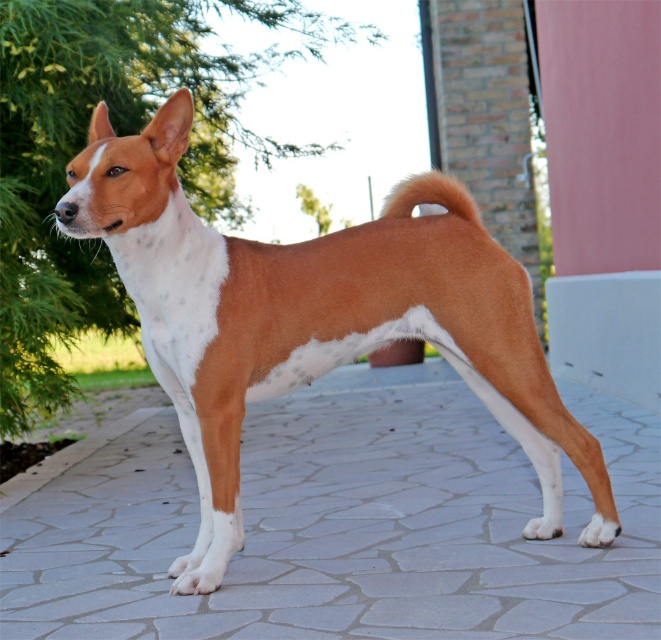
Question: Which object is closer to the camera taking this photo?

Choices:
 (A) brown furry tail at upper right
 (B) gray stone pavement at center

Answer: (A)

Question: Can you confirm if gray stone pavement at center is positioned below brown furry tail at upper right?

Choices:
 (A) no
 (B) yes

Answer: (B)

Question: Which point is farther to the camera?

Choices:
 (A) gray stone pavement at center
 (B) brown furry tail at upper right

Answer: (A)

Question: Which object is closer to the camera taking this photo?

Choices:
 (A) brown furry tail at upper right
 (B) brown/white fur dog at center
 (C) gray stone pavement at center

Answer: (B)

Question: Is the position of brown/white fur dog at center more distant than that of brown furry tail at upper right?

Choices:
 (A) yes
 (B) no

Answer: (B)

Question: Does gray stone pavement at center have a smaller size compared to brown/white fur dog at center?

Choices:
 (A) no
 (B) yes

Answer: (B)